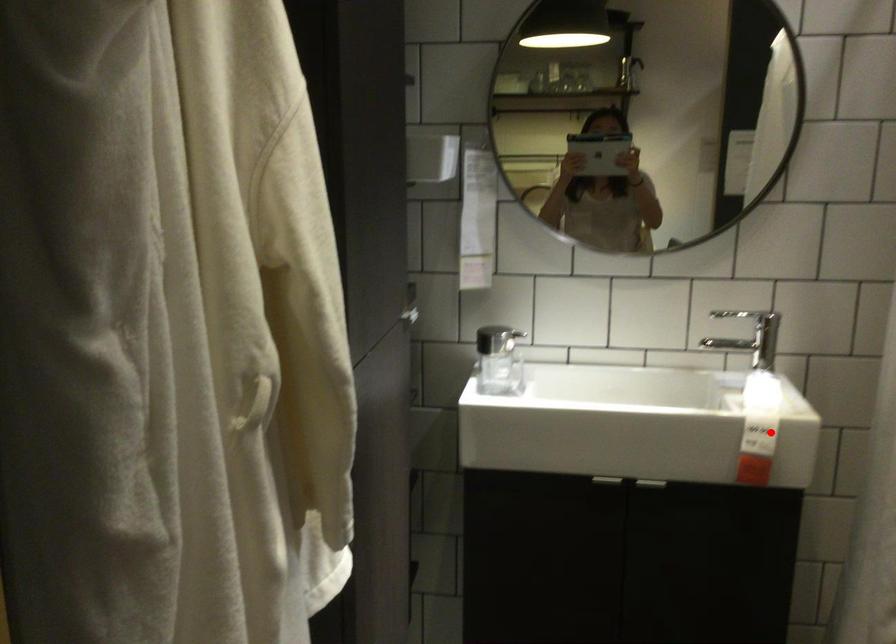
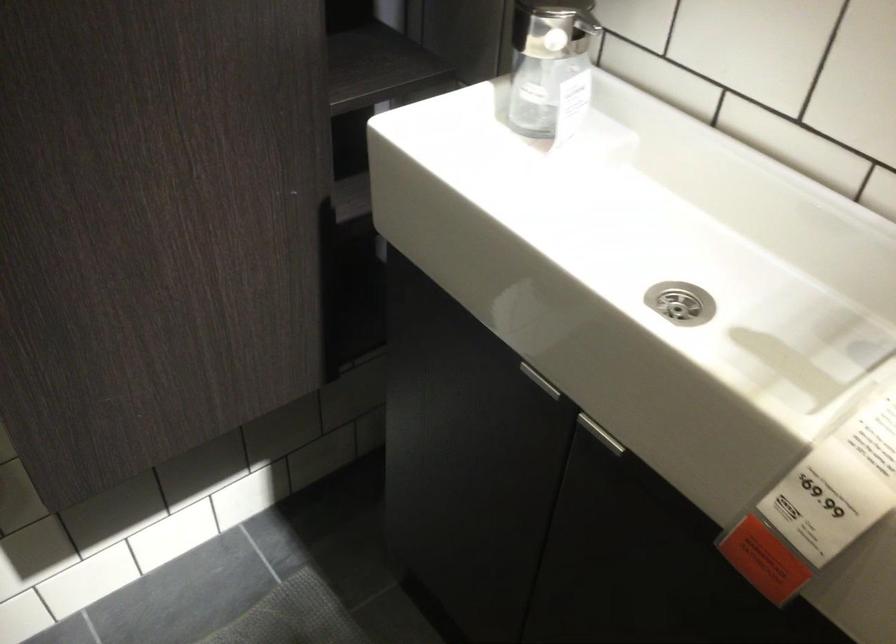
In the second image, find the point that corresponds to the highlighted location in the first image.

(826, 502)